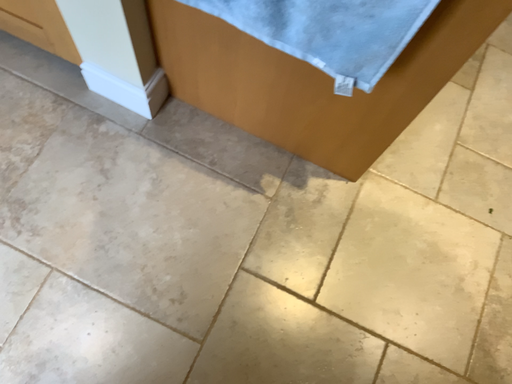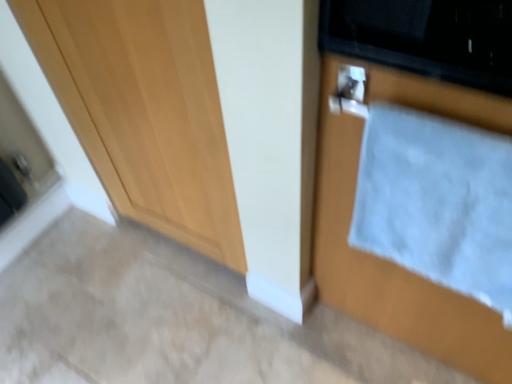
Question: Which way did the camera rotate in the video?

Choices:
 (A) rotated downward
 (B) rotated upward

Answer: (B)